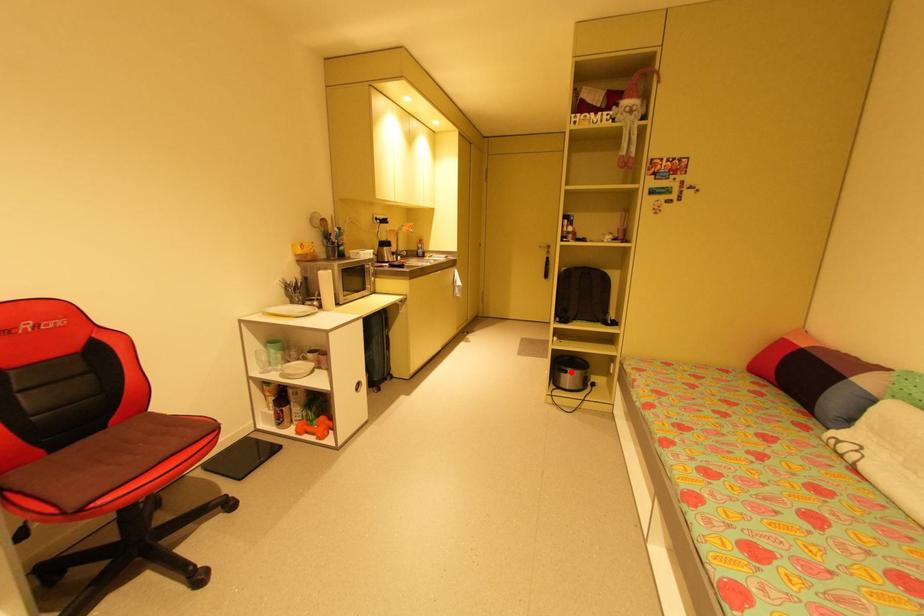
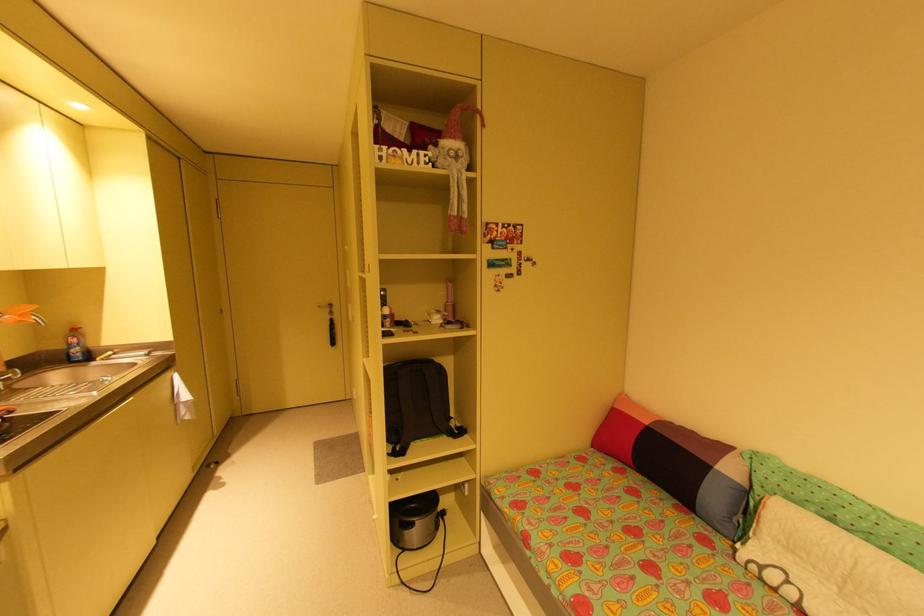
Question: I am providing you with two images of the same scene from different viewpoints. In image1, a red point is highlighted. Considering the same 3D point in image2, which of the following is correct?

Choices:
 (A) It is closer
 (B) It is farther

Answer: (B)